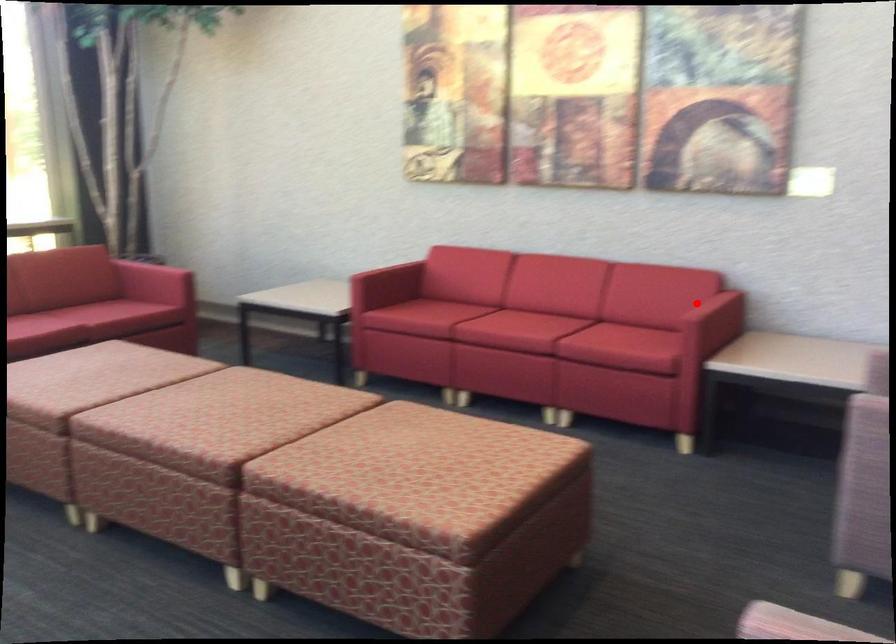
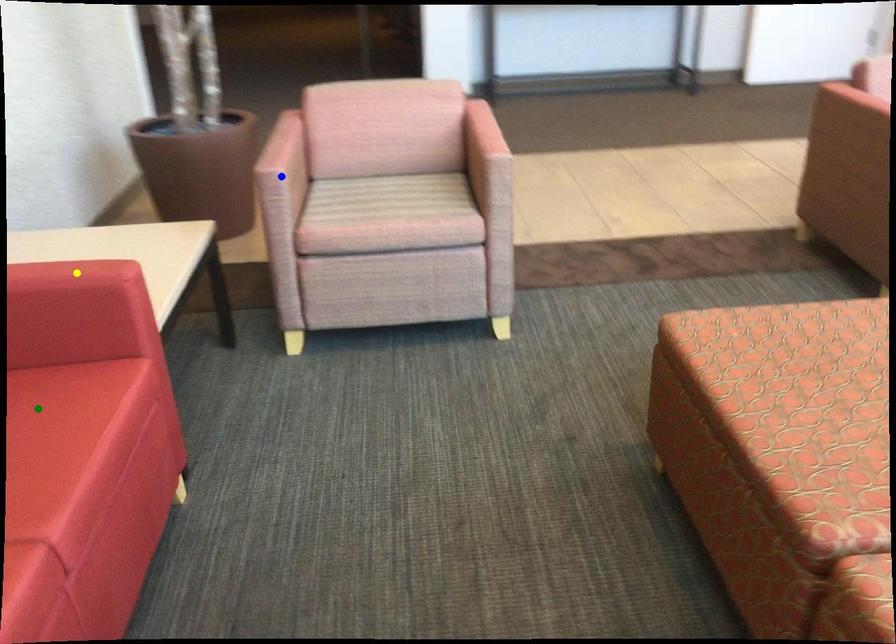
Question: I am providing you with two images of the same scene from different viewpoints. A red point is marked on the first image. You are given multiple points on the second image. Which point in image 2 represents the same 3d spot as the red point in image 1?

Choices:
 (A) blue point
 (B) yellow point
 (C) green point

Answer: (B)